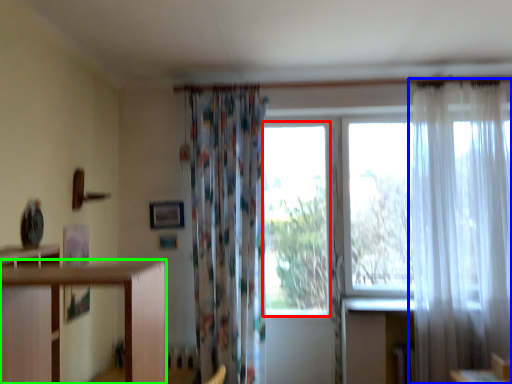
Question: Estimate the real-world distances between objects in this image. Which object is closer to window (highlighted by a red box), curtain (highlighted by a blue box) or furniture (highlighted by a green box)?

Choices:
 (A) curtain
 (B) furniture

Answer: (A)